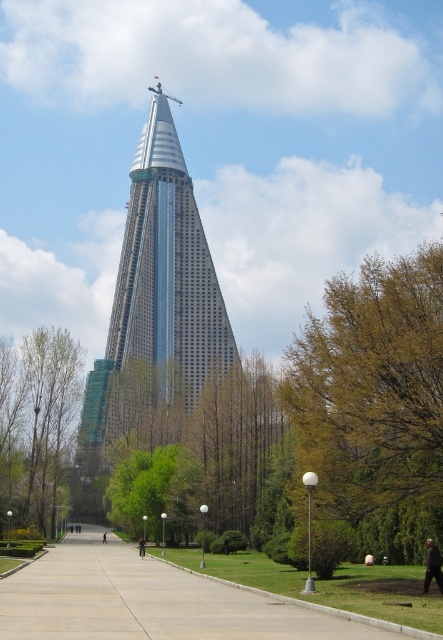
Question: Does green leafy tree at left appear under dark gray jacket at lower right?

Choices:
 (A) no
 (B) yes

Answer: (A)

Question: Which object is positioned farthest from the yellow-green leaves at right?

Choices:
 (A) gray concrete pavement at center
 (B) dark gray jacket at lower right
 (C) black fabric person at center
 (D) green leafy tree at left

Answer: (C)

Question: Can you confirm if yellow-green leaves at right is positioned below silver glass tower at center?

Choices:
 (A) yes
 (B) no

Answer: (A)

Question: Which object is closer to the camera taking this photo?

Choices:
 (A) black fabric jacket at center
 (B) yellow-green leaves at right
 (C) gray concrete pavement at center

Answer: (C)

Question: Does silver glass tower at center have a larger size compared to black fabric person at center?

Choices:
 (A) yes
 (B) no

Answer: (A)

Question: Which is farther from the black fabric person at center?

Choices:
 (A) green leafy tree at left
 (B) gray concrete pavement at center
 (C) dark gray jacket at lower right
 (D) yellow-green leaves at right

Answer: (C)